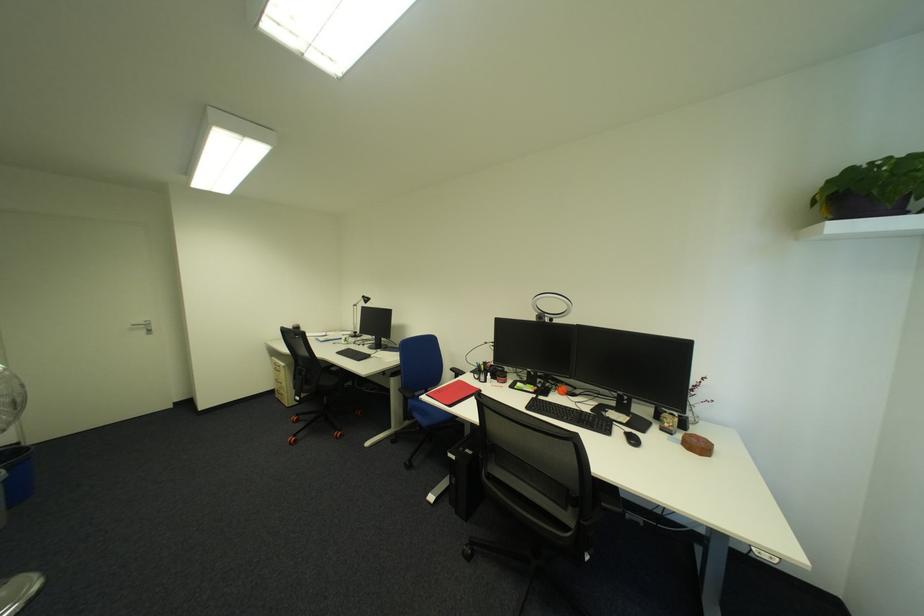
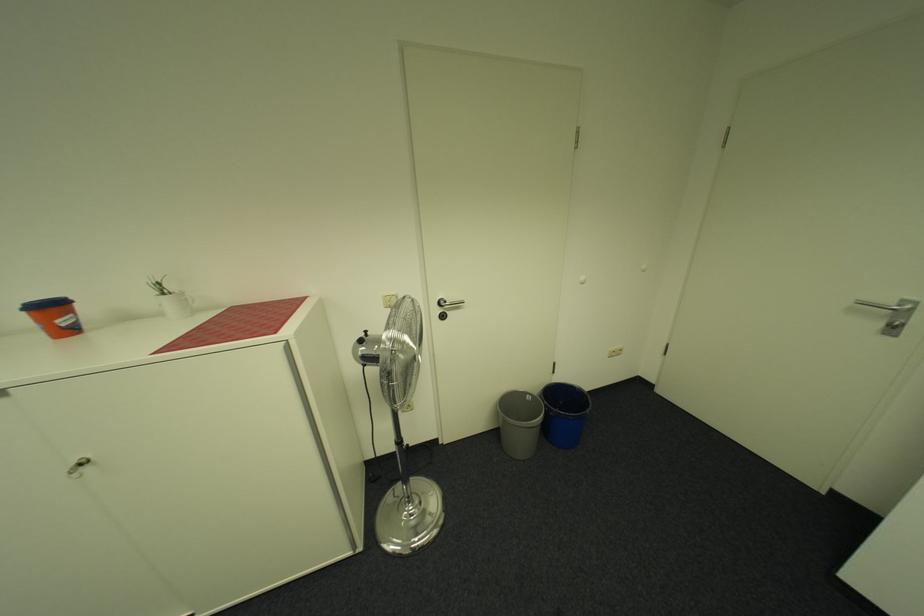
Where in the second image is the point corresponding to pixel 152 323 from the first image?

(898, 302)